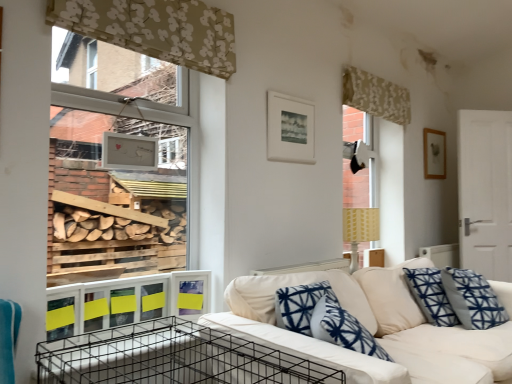
Question: From the image's perspective, is wooden picture frame at upper right, the 2th picture frame from the front, located above white matte picture frame at upper center, marked as the second picture frame in a right-to-left arrangement?

Choices:
 (A) no
 (B) yes

Answer: (A)

Question: From the image's perspective, does wooden picture frame at upper right, the 1th picture frame from the back, appear lower than white matte picture frame at upper center, marked as the second picture frame in a right-to-left arrangement?

Choices:
 (A) yes
 (B) no

Answer: (A)

Question: From a real-world perspective, is wooden picture frame at upper right, the 1th picture frame from the back, over white matte picture frame at upper center, which is the second picture frame in back-to-front order?

Choices:
 (A) yes
 (B) no

Answer: (A)

Question: Is wooden picture frame at upper right, the second picture frame viewed from the left, thinner than white matte picture frame at upper center, placed as the first picture frame when sorted from front to back?

Choices:
 (A) no
 (B) yes

Answer: (A)

Question: Is wooden picture frame at upper right, which appears as the 1th picture frame when viewed from the right, looking in the opposite direction of white matte picture frame at upper center, placed as the first picture frame when sorted from front to back?

Choices:
 (A) yes
 (B) no

Answer: (B)

Question: Considering the relative positions of wooden picture frame at upper right, which appears as the 1th picture frame when viewed from the right, and white matte picture frame at upper center, placed as the first picture frame when sorted from front to back, in the image provided, is wooden picture frame at upper right, which appears as the 1th picture frame when viewed from the right, to the right of white matte picture frame at upper center, placed as the first picture frame when sorted from front to back, from the viewer's perspective?

Choices:
 (A) no
 (B) yes

Answer: (B)

Question: Considering the relative sizes of beige floral fabric at upper center, the 2th curtain positioned from the right, and black wire crate at lower left in the image provided, is beige floral fabric at upper center, the 2th curtain positioned from the right, wider than black wire crate at lower left?

Choices:
 (A) no
 (B) yes

Answer: (A)

Question: Can you confirm if beige floral fabric at upper center, the 2th curtain positioned from the right, is thinner than black wire crate at lower left?

Choices:
 (A) no
 (B) yes

Answer: (B)

Question: Does beige floral fabric at upper center, the 2th curtain positioned from the right, have a larger size compared to black wire crate at lower left?

Choices:
 (A) yes
 (B) no

Answer: (B)

Question: Is beige floral fabric at upper center, the first curtain viewed from the left, oriented away from black wire crate at lower left?

Choices:
 (A) yes
 (B) no

Answer: (B)

Question: Is beige floral fabric at upper center, the 2th curtain positioned from the right, to the left of black wire crate at lower left from the viewer's perspective?

Choices:
 (A) no
 (B) yes

Answer: (B)

Question: From a real-world perspective, is beige floral fabric at upper center, the first curtain viewed from the left, positioned over black wire crate at lower left based on gravity?

Choices:
 (A) yes
 (B) no

Answer: (A)

Question: Is white matte picture frame at upper center, which is the second picture frame in back-to-front order, facing towards wooden picture frame at upper right, the second picture frame viewed from the left?

Choices:
 (A) no
 (B) yes

Answer: (A)